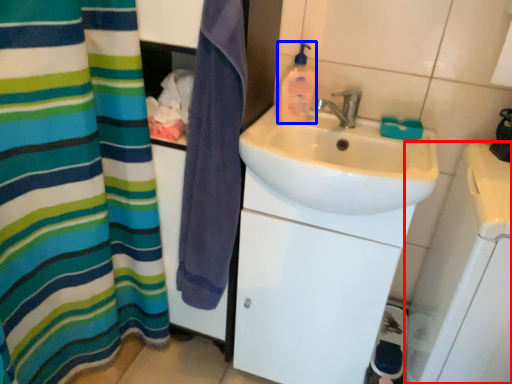
Question: Which point is closer to the camera, appliance (highlighted by a red box) or cleaning product (highlighted by a blue box)?

Choices:
 (A) appliance
 (B) cleaning product

Answer: (A)